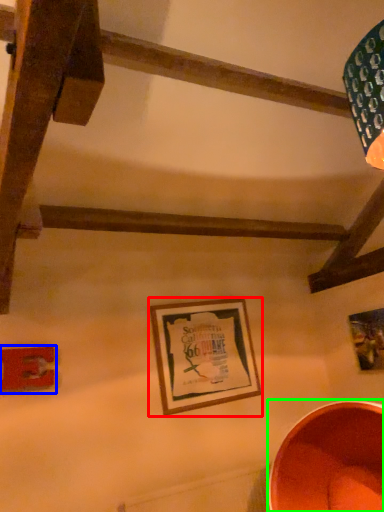
Question: Estimate the real-world distances between objects in this image. Which object is farther from picture frame (highlighted by a red box), picture frame (highlighted by a blue box) or basin (highlighted by a green box)?

Choices:
 (A) picture frame
 (B) basin

Answer: (A)